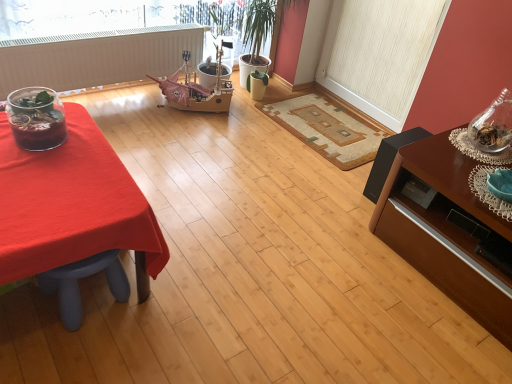
Find the location of a particular element. The height and width of the screenshot is (384, 512). white matte radiator at upper left is located at coordinates (97, 57).

This screenshot has height=384, width=512. What do you see at coordinates (97, 57) in the screenshot? I see `white matte radiator at upper left` at bounding box center [97, 57].

In order to face white textured screen door at upper right, should I rotate leftwards or rightwards?

A 15.429 degree turn to the right will do.

Image resolution: width=512 pixels, height=384 pixels. What do you see at coordinates (448, 232) in the screenshot?
I see `brown wood table at right` at bounding box center [448, 232].

In order to face translucent glass terrarium at left, should I rotate leftwards or rightwards?

To face it directly, rotate left by 27.244 degrees.

What do you see at coordinates (36, 118) in the screenshot?
I see `translucent glass terrarium at left` at bounding box center [36, 118].

At what (x,y) coordinates should I click in order to perform the action: click on beige woven mat at center. Please return your answer as a coordinate pair (x, y). The height and width of the screenshot is (384, 512). Looking at the image, I should click on (327, 128).

How many degrees apart are the facing directions of beige woven mat at center and brown wood table at right?

2.6 degrees separate the facing orientations of beige woven mat at center and brown wood table at right.

Is beige woven mat at center at the left side of brown wood table at right?

Yes, beige woven mat at center is to the left of brown wood table at right.

Considering the positions of points (337, 113) and (426, 147), is point (337, 113) closer to camera compared to point (426, 147)?

No, it is behind (426, 147).

Is brown wood table at right completely or partially inside beige woven mat at center?

No.

Which object is closer to the camera, clear glass jar at right or translucent glass terrarium at left?

translucent glass terrarium at left is closer to the camera.

Is there a large distance between clear glass jar at right and translucent glass terrarium at left?

clear glass jar at right is far away from translucent glass terrarium at left.

In terms of width, does clear glass jar at right look wider or thinner when compared to translucent glass terrarium at left?

Considering their sizes, clear glass jar at right looks slimmer than translucent glass terrarium at left.

Is clear glass jar at right turned away from translucent glass terrarium at left?

No.

From the image's perspective, is clear glass jar at right positioned above or below white matte radiator at upper left?

clear glass jar at right is below white matte radiator at upper left.

Locate an element on the screen. Image resolution: width=512 pixels, height=384 pixels. radiator behind the clear glass jar at right is located at coordinates pyautogui.click(x=97, y=57).

Considering the sizes of clear glass jar at right and white matte radiator at upper left in the image, is clear glass jar at right wider or thinner than white matte radiator at upper left?

In the image, clear glass jar at right appears to be wider than white matte radiator at upper left.

Considering the sizes of objects clear glass jar at right and smooth red tablecloth at left in the image provided, who is thinner, clear glass jar at right or smooth red tablecloth at left?

Thinner between the two is clear glass jar at right.

Considering the positions of objects clear glass jar at right and smooth red tablecloth at left in the image provided, who is more to the right, clear glass jar at right or smooth red tablecloth at left?

From the viewer's perspective, clear glass jar at right appears more on the right side.

Is the surface of clear glass jar at right in direct contact with smooth red tablecloth at left?

No, clear glass jar at right is not next to smooth red tablecloth at left.

Looking at this image, can you tell me how much clear glass jar at right and smooth red tablecloth at left differ in facing direction?

90.1 degrees separate the facing orientations of clear glass jar at right and smooth red tablecloth at left.

What's the angular difference between beige woven mat at center and white matte radiator at upper left's facing directions?

They differ by 87.9 degrees in their facing directions.

Considering the relative sizes of beige woven mat at center and white matte radiator at upper left in the image provided, is beige woven mat at center shorter than white matte radiator at upper left?

Yes, beige woven mat at center is shorter than white matte radiator at upper left.

Which is more distant, (x=337, y=115) or (x=200, y=49)?

The point (x=337, y=115) is farther.

Where is `radiator above the beige woven mat at center (from a real-world perspective)`? radiator above the beige woven mat at center (from a real-world perspective) is located at coordinates (97, 57).

I want to click on desk below the white matte radiator at upper left (from a real-world perspective), so click(x=71, y=203).

Is smooth red tablecloth at left at the back of white matte radiator at upper left?

No, white matte radiator at upper left is not facing the opposite direction of smooth red tablecloth at left.

Is point (183, 25) positioned behind point (38, 243)?

Yes.

Which point is more forward, [46,140] or [168,45]?

The point [46,140] is more forward.

Can you confirm if translucent glass terrarium at left is shorter than white matte radiator at upper left?

Yes.

In the scene shown: Can you confirm if translucent glass terrarium at left is bigger than white matte radiator at upper left?

Actually, translucent glass terrarium at left might be smaller than white matte radiator at upper left.

From a real-world perspective, is translucent glass terrarium at left physically located above or below white matte radiator at upper left?

Clearly, from a real-world perspective, translucent glass terrarium at left is above white matte radiator at upper left.

Where is `table below the beige woven mat at center (from the image's perspective)`? The width and height of the screenshot is (512, 384). table below the beige woven mat at center (from the image's perspective) is located at coordinates (448, 232).

Identify the location of food below the clear glass jar at right (from a real-world perspective). tap(36, 118).

Based on their spatial positions, is white textured screen door at upper right or clear glass jar at right further from beige woven mat at center?

clear glass jar at right is further to beige woven mat at center.

When comparing their distances from translucent glass terrarium at left, does beige woven mat at center or smooth red tablecloth at left seem further?

Based on the image, beige woven mat at center appears to be further to translucent glass terrarium at left.

Based on their spatial positions, is white textured screen door at upper right or white matte radiator at upper left further from clear glass jar at right?

Based on the image, white matte radiator at upper left appears to be further to clear glass jar at right.

In the scene shown: Considering their positions, is clear glass jar at right positioned closer to white matte radiator at upper left than beige woven mat at center?

beige woven mat at center lies closer to white matte radiator at upper left than the other object.

From the image, which object appears to be farther from brown wood table at right, smooth red tablecloth at left or white matte radiator at upper left?

white matte radiator at upper left is further to brown wood table at right.

Considering their positions, is brown wood table at right positioned closer to clear glass jar at right than smooth red tablecloth at left?

Among the two, brown wood table at right is located nearer to clear glass jar at right.

Which object lies further to the anchor point brown wood table at right, translucent glass terrarium at left or clear glass jar at right?

translucent glass terrarium at left is further to brown wood table at right.

Based on their spatial positions, is smooth red tablecloth at left or white textured screen door at upper right further from clear glass jar at right?

smooth red tablecloth at left.

Locate an element on the screen. Image resolution: width=512 pixels, height=384 pixels. desk between white matte radiator at upper left and brown wood table at right in the horizontal direction is located at coordinates (71, 203).

Image resolution: width=512 pixels, height=384 pixels. I want to click on screen door between white matte radiator at upper left and brown wood table at right, so click(379, 54).

In order to click on mat between white matte radiator at upper left and clear glass jar at right in the horizontal direction in this screenshot , I will do `click(327, 128)`.

The height and width of the screenshot is (384, 512). What are the coordinates of `screen door positioned between brown wood table at right and beige woven mat at center from near to far` in the screenshot? It's located at point(379,54).